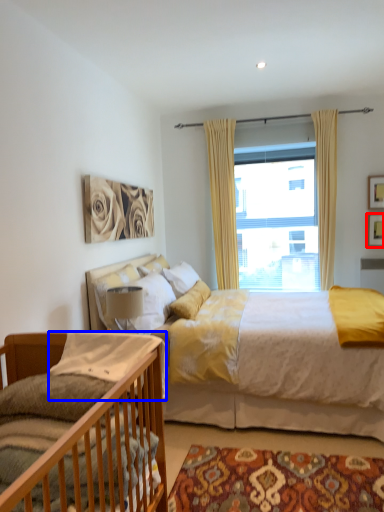
Question: Which of the following is the closest to the observer, picture frame (highlighted by a red box) or pillow (highlighted by a blue box)?

Choices:
 (A) picture frame
 (B) pillow

Answer: (B)